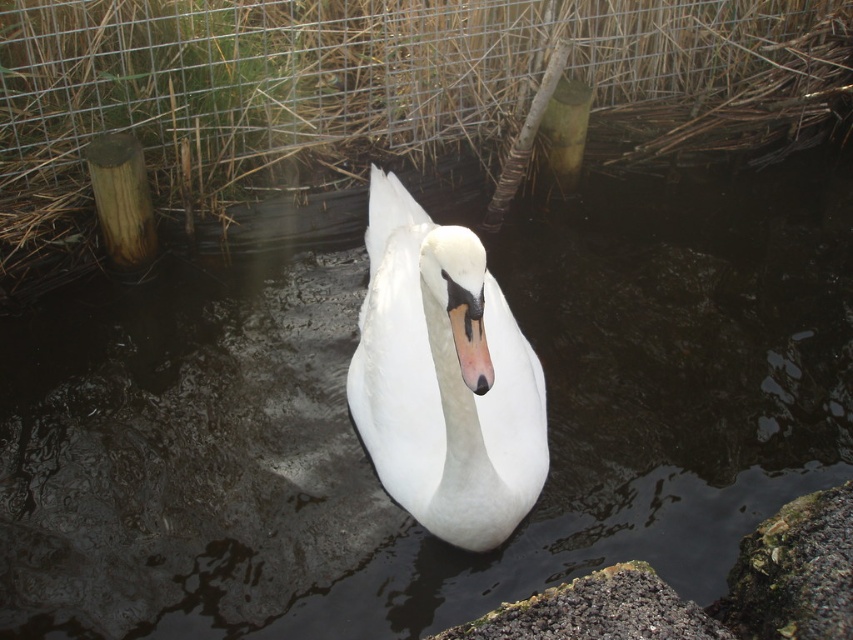
Is metal wire fence at upper center above gray gravelly rock at lower center?

Yes, metal wire fence at upper center is above gray gravelly rock at lower center.

Describe the element at coordinates (320, 84) in the screenshot. The width and height of the screenshot is (853, 640). I see `metal wire fence at upper center` at that location.

Is point (364, 70) closer to viewer compared to point (683, 621)?

No, it is not.

Find the location of a particular element. The height and width of the screenshot is (640, 853). metal wire fence at upper center is located at coordinates (320, 84).

Between metal wire fence at upper center and white glossy swan at center, which one appears on the right side from the viewer's perspective?

metal wire fence at upper center

Does metal wire fence at upper center have a greater height compared to white glossy swan at center?

Indeed, metal wire fence at upper center has a greater height compared to white glossy swan at center.

Which is behind, point (628, 65) or point (460, 320)?

Point (628, 65)

Find the location of a particular element. Image resolution: width=853 pixels, height=640 pixels. metal wire fence at upper center is located at coordinates (320, 84).

Does white glossy swan at center have a larger size compared to gray gravelly rock at lower center?

Yes, white glossy swan at center is bigger than gray gravelly rock at lower center.

Does white glossy swan at center have a lesser width compared to gray gravelly rock at lower center?

Indeed, white glossy swan at center has a lesser width compared to gray gravelly rock at lower center.

Which is behind, point (398, 262) or point (605, 634)?

Point (398, 262)

What are the coordinates of `white glossy swan at center` in the screenshot? It's located at (444, 378).